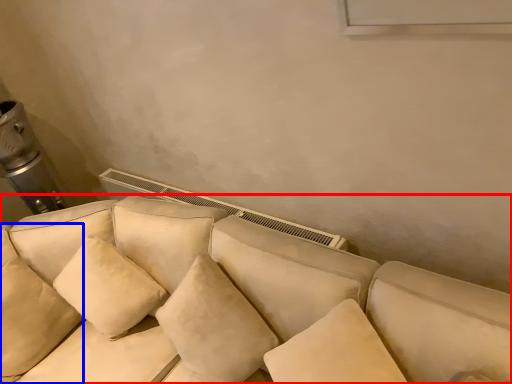
Question: Which object is further to the camera taking this photo, studio couch (highlighted by a red box) or pillow (highlighted by a blue box)?

Choices:
 (A) studio couch
 (B) pillow

Answer: (B)